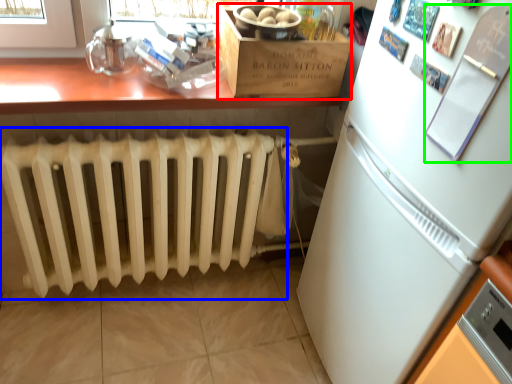
Question: Based on their relative distances, which object is farther from cardboard box (highlighted by a red box)? Choose from radiator (highlighted by a blue box) and bulletin board (highlighted by a green box).

Choices:
 (A) radiator
 (B) bulletin board

Answer: (B)